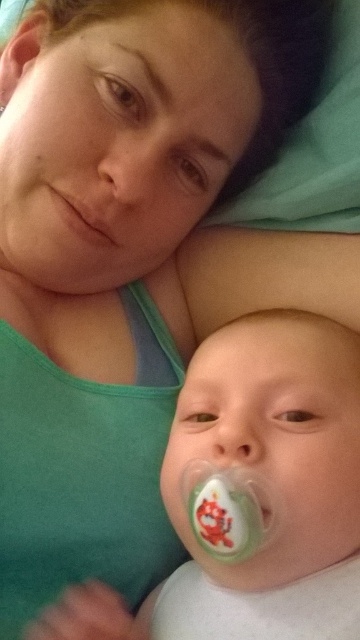
Question: Does matte pink lips at center appear on the left side of green rubber teething ring at lower center?

Choices:
 (A) no
 (B) yes

Answer: (A)

Question: Which point appears closest to the camera in this image?

Choices:
 (A) coord(1,108)
 (B) coord(74,227)

Answer: (B)

Question: Considering the relative positions of matte pink lips at center and green rubber teething ring at lower center in the image provided, where is matte pink lips at center located with respect to green rubber teething ring at lower center?

Choices:
 (A) left
 (B) right

Answer: (B)

Question: Which point is closer to the camera taking this photo?

Choices:
 (A) (0, 112)
 (B) (102, 193)
 (C) (255, 554)

Answer: (C)

Question: Which of the following is the closest to the observer?

Choices:
 (A) (111, 211)
 (B) (240, 458)
 (C) (0, 100)

Answer: (B)

Question: Considering the relative positions of matte pink lips at center and green rubber teething ring at lower center in the image provided, where is matte pink lips at center located with respect to green rubber teething ring at lower center?

Choices:
 (A) above
 (B) below

Answer: (B)